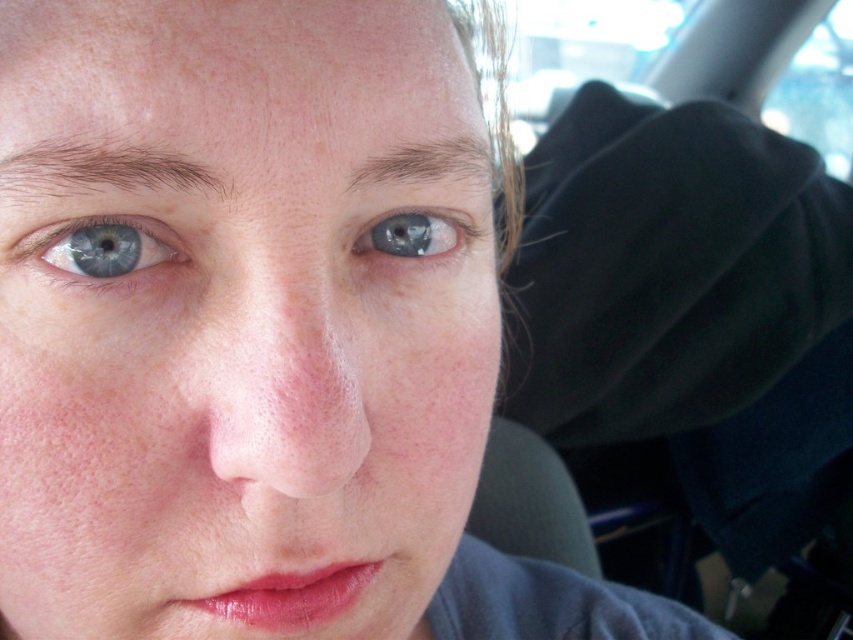
Between point (357, 536) and point (138, 241), which one is positioned behind?

Point (357, 536)

Is smooth skin face at center shorter than blue matte eye at left?

In fact, smooth skin face at center may be taller than blue matte eye at left.

Is point (357, 38) positioned in front of point (70, 244)?

That is False.

You are a GUI agent. You are given a task and a screenshot of the screen. Output one action in this format:
    pyautogui.click(x=<x>, y=<y>)
    Task: Click on the smooth skin face at center
    The image size is (853, 640).
    Given the screenshot: What is the action you would take?
    [235, 317]

Is blue matte eye at left wider than blue glossy eye at upper center?

Correct, the width of blue matte eye at left exceeds that of blue glossy eye at upper center.

Does blue matte eye at left have a smaller size compared to blue glossy eye at upper center?

Correct, blue matte eye at left occupies less space than blue glossy eye at upper center.

Between point (103, 269) and point (409, 248), which one is positioned in front?

Point (103, 269) is in front.

Identify the location of blue matte eye at left. (97, 248).

Which is below, smooth skin face at center or blue glossy eye at upper center?

smooth skin face at center is lower down.

Can you confirm if smooth skin face at center is positioned to the right of blue glossy eye at upper center?

Incorrect, smooth skin face at center is not on the right side of blue glossy eye at upper center.

This screenshot has width=853, height=640. I want to click on smooth skin face at center, so click(235, 317).

At what (x,y) coordinates should I click in order to perform the action: click on smooth skin face at center. Please return your answer as a coordinate pair (x, y). Looking at the image, I should click on (235, 317).